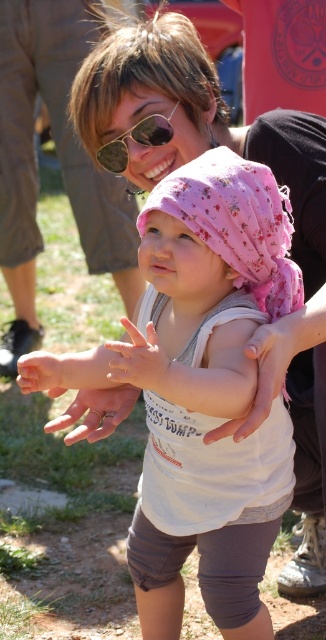
Question: Which of the following is the farthest from the observer?

Choices:
 (A) (153, 140)
 (B) (148, 348)

Answer: (A)

Question: Does pink fabric hat at center have a larger size compared to gold metallic ring at center?

Choices:
 (A) no
 (B) yes

Answer: (B)

Question: Does white matte hand at center appear under smooth skin hand at center?

Choices:
 (A) yes
 (B) no

Answer: (B)

Question: Is gold metallic ring at center positioned before smooth skin hand at center?

Choices:
 (A) no
 (B) yes

Answer: (A)

Question: Estimate the real-world distances between objects in this image. Which object is farther from the smooth skin hand at center?

Choices:
 (A) gold metallic ring at center
 (B) white matte hand at center
 (C) pink fabric hat at center

Answer: (C)

Question: Which of the following is the closest to the observer?

Choices:
 (A) (105, 412)
 (B) (150, 384)
 (C) (10, 17)
 (D) (163, 598)

Answer: (B)